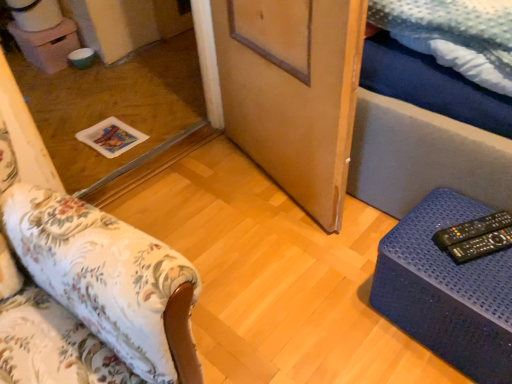
The height and width of the screenshot is (384, 512). Identify the location of vacant position to the left of black plastic remote at lower right, which is the 1th remote in front-to-back order. (424, 253).